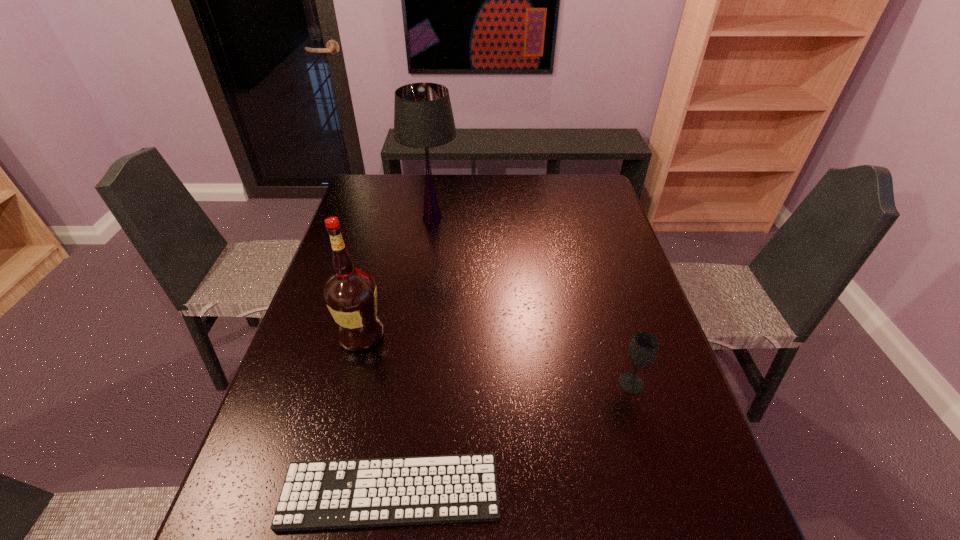
Identify the location of blank space located 0.190m on the back of the third tallest object. (611, 315).

Find the location of a particular element. The image size is (960, 540). vacant region located on the left of the nearest object is located at coordinates (241, 491).

At what (x,y) coordinates should I click in order to perform the action: click on object that is at the far edge. Please return your answer as a coordinate pair (x, y). Looking at the image, I should click on (423, 118).

Locate an element on the screen. The image size is (960, 540). alcohol that is at the left edge is located at coordinates (350, 294).

The width and height of the screenshot is (960, 540). I want to click on computer keyboard that is positioned at the left edge, so click(355, 493).

Locate an element on the screen. The image size is (960, 540). object at the right edge is located at coordinates (643, 350).

In the image, there is a desktop. At what (x,y) coordinates should I click in order to perform the action: click on vacant space at the far edge. Please return your answer as a coordinate pair (x, y). Looking at the image, I should click on (444, 173).

Find the location of a particular element. The width and height of the screenshot is (960, 540). vacant region at the left edge of the desktop is located at coordinates (378, 271).

Identify the location of vacant space at the right edge of the desktop. This screenshot has width=960, height=540. (637, 286).

Identify the location of vacant region at the far right corner of the desktop. (579, 205).